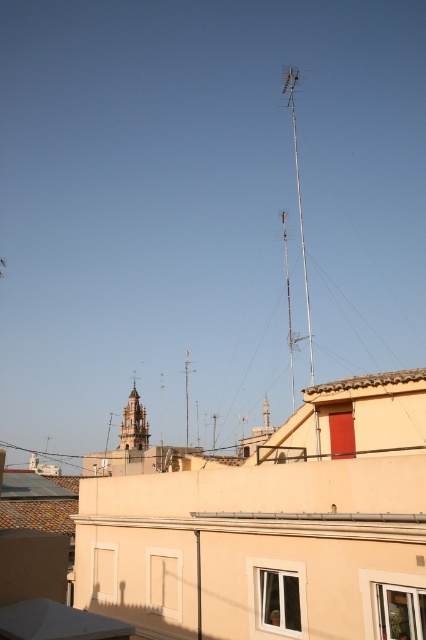
You are a drone operator trying to land a drone on the rooftop of the beige building with the red door. The drone has a GPS coordinate system where the bottom left corner of the image is the origin point. The drone needs to land at the exact location of the metallic antenna at upper center. What are the coordinates where you should direct the drone to land?

The coordinates for the metallic antenna at upper center are at point (299,196). Direct the drone to land there.

You are a drone operator tasked with flying a drone from the metallic antenna at upper center to the golden stone tower at center. The drone has a maximum flight range of 100 meters. Can the drone complete the journey without needing to recharge?

The distance between the metallic antenna at upper center and the golden stone tower at center is 129.60 meters, which exceeds the drone s maximum flight range of 100 meters. Therefore, the drone cannot complete the journey without recharging.

You are a drone operator who needs to fly a drone from your current position to the metallic antenna at upper center. The drone has a maximum flight range of 900 feet. Can the drone reach the antenna without needing to recharge?

The metallic antenna at upper center is 886.06 feet from camera, so yes, the drone can reach the antenna without needing to recharge since it is within the 900 feet range.